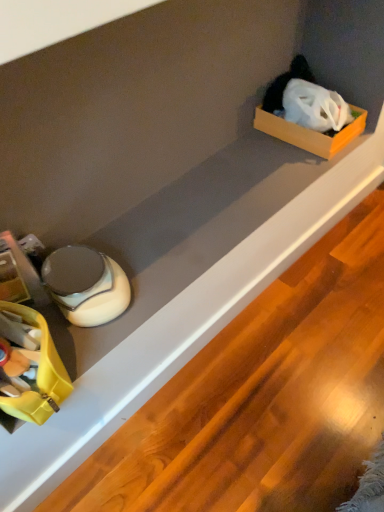
Question: Does yellow plastic storage box at lower left have a lesser height compared to orange cardboard box at upper right?

Choices:
 (A) no
 (B) yes

Answer: (A)

Question: Is yellow plastic storage box at lower left at the left side of orange cardboard box at upper right?

Choices:
 (A) no
 (B) yes

Answer: (B)

Question: Considering the relative sizes of yellow plastic storage box at lower left and orange cardboard box at upper right in the image provided, is yellow plastic storage box at lower left bigger than orange cardboard box at upper right?

Choices:
 (A) yes
 (B) no

Answer: (A)

Question: Is yellow plastic storage box at lower left closer to camera compared to orange cardboard box at upper right?

Choices:
 (A) yes
 (B) no

Answer: (A)

Question: Does yellow plastic storage box at lower left appear on the right side of orange cardboard box at upper right?

Choices:
 (A) yes
 (B) no

Answer: (B)

Question: Is yellow plastic storage box at lower left oriented towards orange cardboard box at upper right?

Choices:
 (A) no
 (B) yes

Answer: (A)

Question: Is there a large distance between orange cardboard box at upper right and yellow plastic storage box at lower left?

Choices:
 (A) yes
 (B) no

Answer: (B)

Question: Considering the relative sizes of orange cardboard box at upper right and yellow plastic storage box at lower left in the image provided, is orange cardboard box at upper right bigger than yellow plastic storage box at lower left?

Choices:
 (A) no
 (B) yes

Answer: (A)

Question: Is yellow plastic storage box at lower left completely or partially inside orange cardboard box at upper right?

Choices:
 (A) no
 (B) yes

Answer: (A)

Question: Is orange cardboard box at upper right completely or partially outside of yellow plastic storage box at lower left?

Choices:
 (A) no
 (B) yes

Answer: (B)

Question: From a real-world perspective, is orange cardboard box at upper right beneath yellow plastic storage box at lower left?

Choices:
 (A) no
 (B) yes

Answer: (B)

Question: Considering the relative sizes of orange cardboard box at upper right and yellow plastic storage box at lower left in the image provided, is orange cardboard box at upper right smaller than yellow plastic storage box at lower left?

Choices:
 (A) no
 (B) yes

Answer: (B)

Question: Which is correct: yellow plastic storage box at lower left is inside orange cardboard box at upper right, or outside of it?

Choices:
 (A) inside
 (B) outside

Answer: (B)